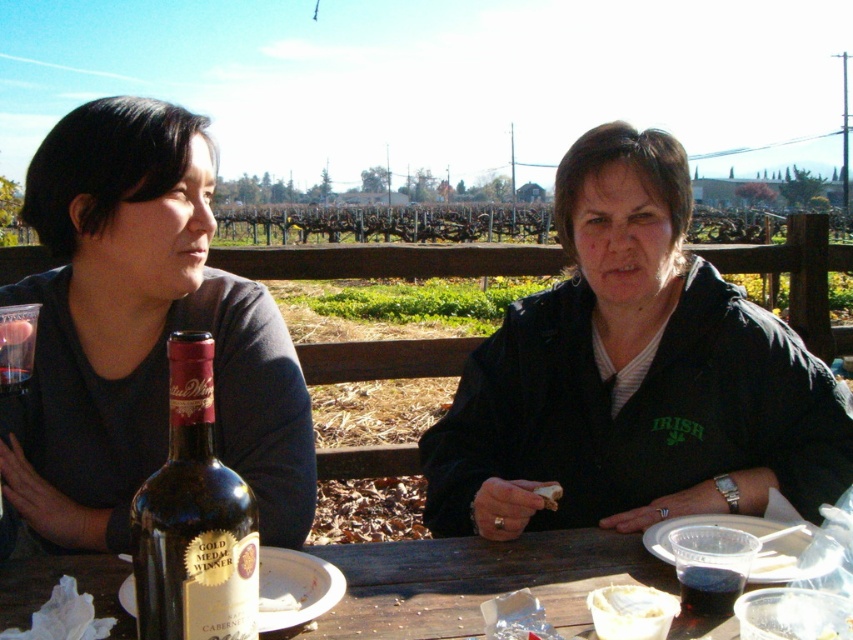
You are a waiter at a picnic area and need to place a 24 inch long bottle of champagne between the dark glass bottle at center and the transparent plastic cup at lower left. Is there enough space between them to fit the bottle?

The dark glass bottle at center and transparent plastic cup at lower left are 23.60 inches apart from each other. Since the champagne bottle is 24 inches long, there isn not enough space between them to fit the bottle.

You are a server at a wine tasting event and need to determine which item to pick up first. Since the transparent plastic cup at lower left is taller than the white creamy bowl at lower center, which one should you pick up first to avoid spills?

The transparent plastic cup at lower left is taller than the white creamy bowl at lower center, so you should pick up the transparent plastic cup at lower left first to avoid spills, as taller containers are less stable and more prone to tipping over.